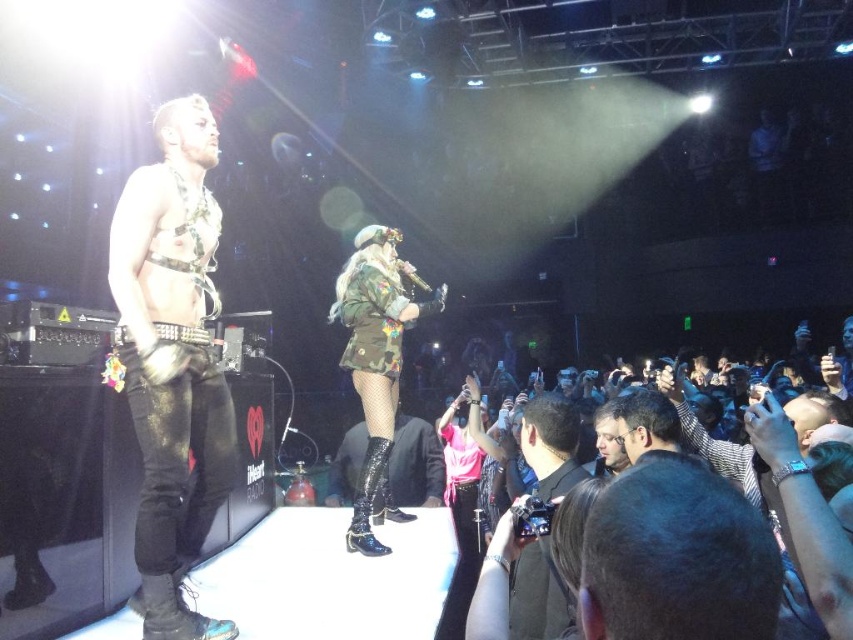
Question: Does dark brown hair at lower right appear over camouflage fabric jacket at center?

Choices:
 (A) no
 (B) yes

Answer: (B)

Question: Which point is closer to the camera?

Choices:
 (A) (451, 486)
 (B) (712, 541)
 (C) (550, 412)

Answer: (B)

Question: Which point is closer to the camera?

Choices:
 (A) (361, 467)
 (B) (213, 225)

Answer: (B)

Question: Can you confirm if pink satin dress at center is positioned to the right of glossy patent leather boot at center?

Choices:
 (A) no
 (B) yes

Answer: (B)

Question: Which object appears closest to the camera in this image?

Choices:
 (A) pink satin dress at center
 (B) black leather jacket at center

Answer: (B)

Question: Does dark brown hair at lower right have a lesser width compared to black leather jacket at center?

Choices:
 (A) yes
 (B) no

Answer: (A)